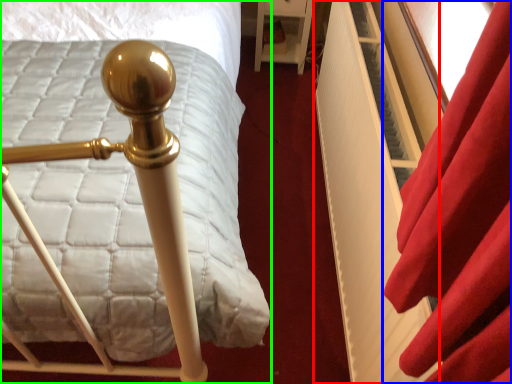
Question: Based on their relative distances, which object is nearer to bed frame (highlighted by a red box)? Choose from curtain (highlighted by a blue box) and bed (highlighted by a green box).

Choices:
 (A) curtain
 (B) bed

Answer: (A)